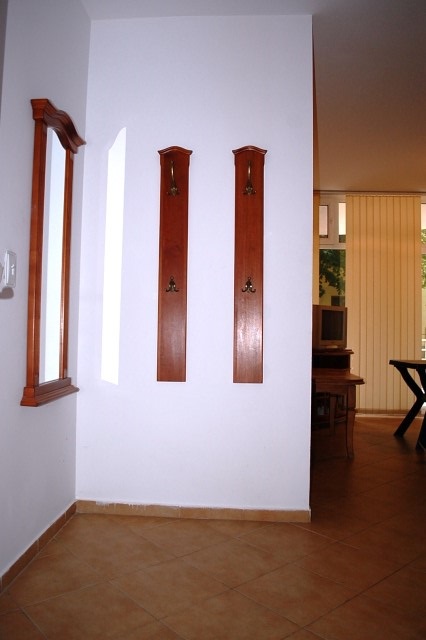
The height and width of the screenshot is (640, 426). In order to click on wall decor in this screenshot , I will do `click(164, 251)`, `click(253, 319)`.